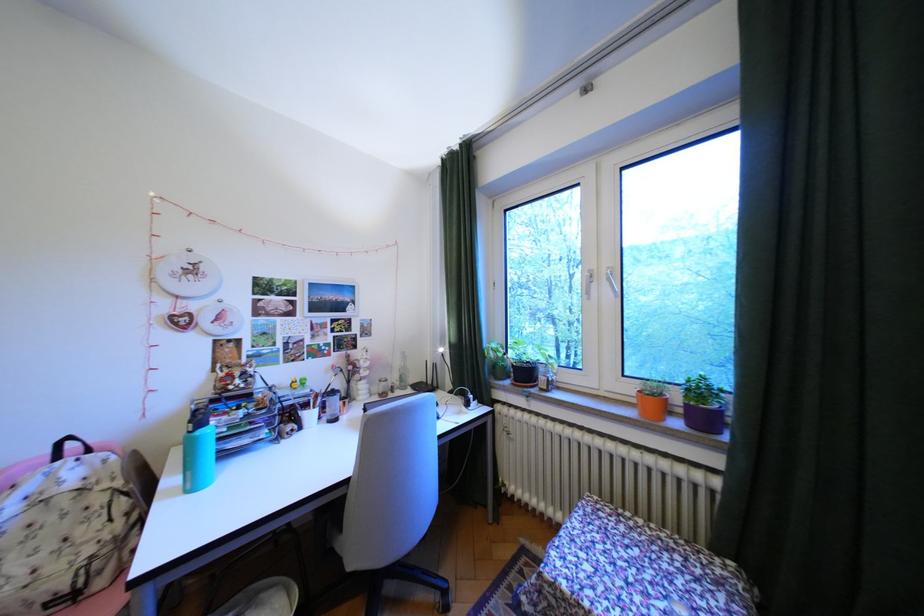
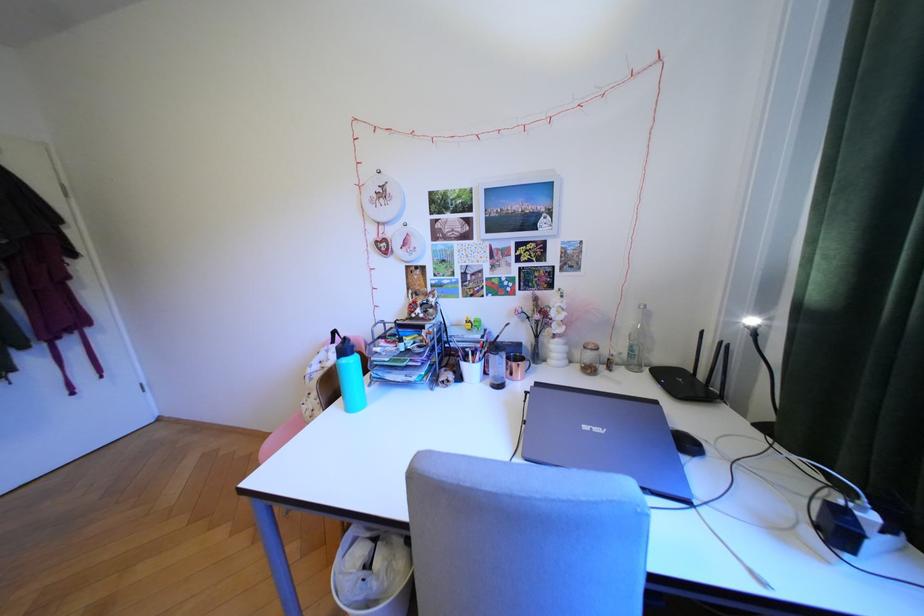
Question: Based on the continuous images, in which direction is the camera rotating? Reply with the corresponding letter.

Choices:
 (A) Left
 (B) Right
 (C) Up
 (D) Down

Answer: (A)